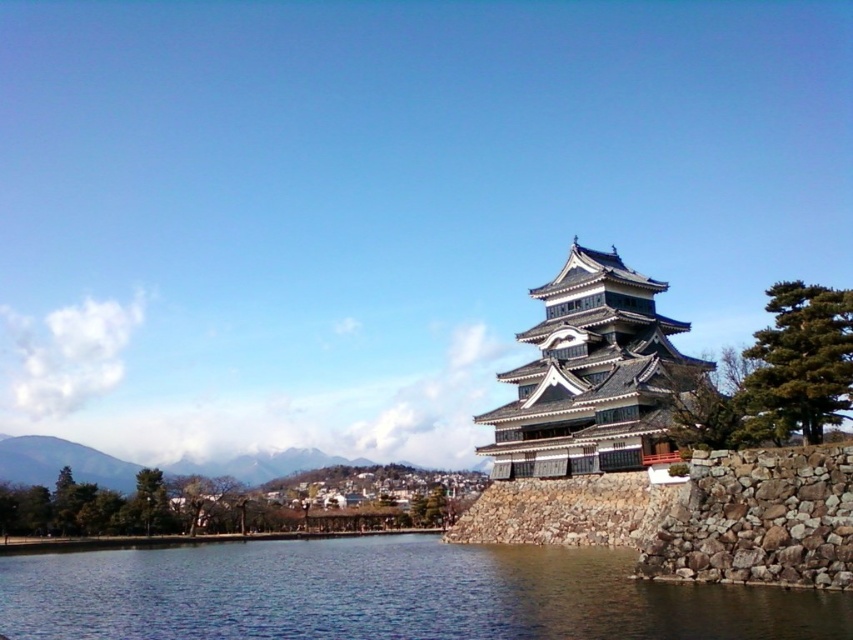
Between blue water at lower left and gray stone tower at center, which one is positioned higher?

gray stone tower at center

Is point (74, 556) more distant than point (595, 342)?

Yes, point (74, 556) is farther from viewer.

Locate an element on the screen. blue water at lower left is located at coordinates (387, 595).

Image resolution: width=853 pixels, height=640 pixels. Identify the location of blue water at lower left. pos(387,595).